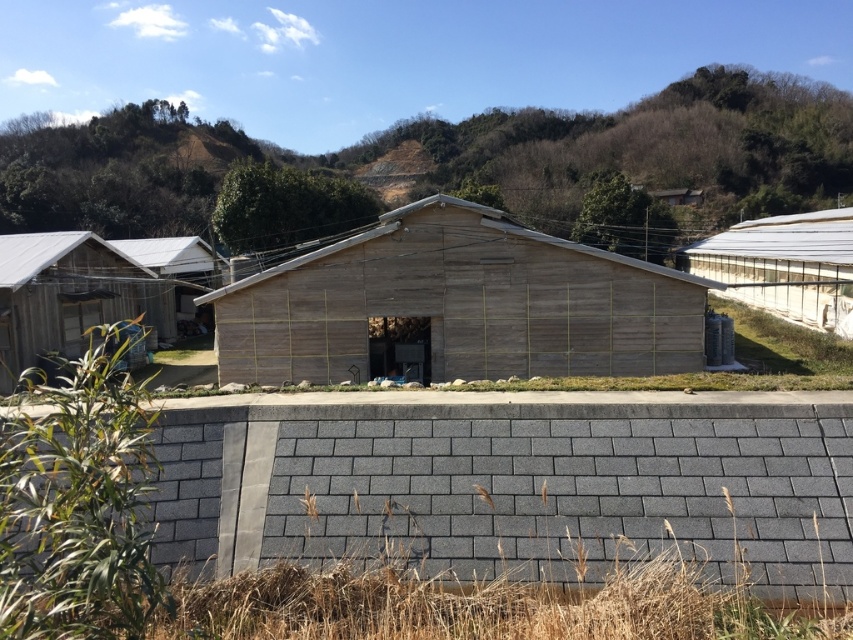
Question: Does wooden hut at center have a larger size compared to transparent plastic greenhouse at right?

Choices:
 (A) no
 (B) yes

Answer: (A)

Question: Considering the real-world distances, which object is farthest from the wooden hut at left?

Choices:
 (A) wooden hut at center
 (B) green leafy hillside at upper center

Answer: (B)

Question: Which of the following is the closest to the observer?

Choices:
 (A) wooden hut at center
 (B) wooden hut at left
 (C) transparent plastic greenhouse at right

Answer: (A)

Question: Does green leafy hillside at upper center have a lesser width compared to transparent plastic greenhouse at right?

Choices:
 (A) no
 (B) yes

Answer: (A)

Question: Does green leafy hillside at upper center appear over wooden hut at center?

Choices:
 (A) no
 (B) yes

Answer: (B)

Question: Which of the following is the farthest from the observer?

Choices:
 (A) (770, 244)
 (B) (61, 296)
 (C) (398, 218)
 (D) (721, 177)

Answer: (D)